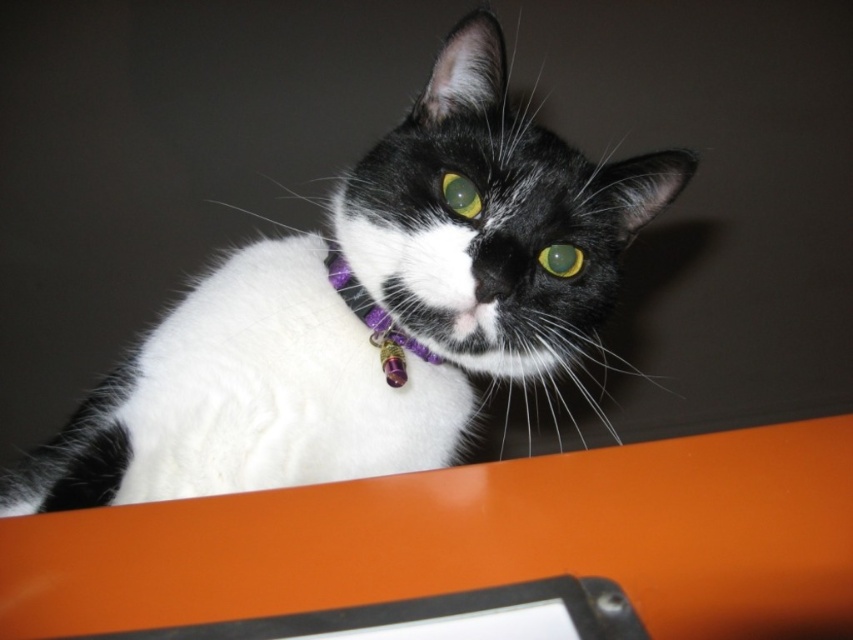
Is point (378, 301) closer to camera compared to point (392, 323)?

Yes, point (378, 301) is in front of point (392, 323).

Who is more distant from viewer, (346, 358) or (370, 312)?

Point (370, 312)

From the picture: Measure the distance between white fur cat at center and camera.

white fur cat at center is 81.48 centimeters from camera.

The image size is (853, 640). I want to click on white fur cat at center, so click(x=357, y=317).

The height and width of the screenshot is (640, 853). What do you see at coordinates (474, 540) in the screenshot?
I see `orange glossy table at upper center` at bounding box center [474, 540].

Based on the photo, is orange glossy table at upper center shorter than green glossy eye at center?

No, orange glossy table at upper center is not shorter than green glossy eye at center.

Measure the distance between orange glossy table at upper center and camera.

orange glossy table at upper center and camera are 15.42 inches apart from each other.

Identify the location of orange glossy table at upper center. (474, 540).

Can you confirm if white fur cat at center is positioned to the right of green glossy eye at center?

No, white fur cat at center is not to the right of green glossy eye at center.

Does white fur cat at center appear under green glossy eye at center?

Correct, white fur cat at center is located below green glossy eye at center.

Does point (430, 448) come closer to viewer compared to point (573, 264)?

No, it is behind (573, 264).

Where is `white fur cat at center`? The height and width of the screenshot is (640, 853). white fur cat at center is located at coordinates (357, 317).